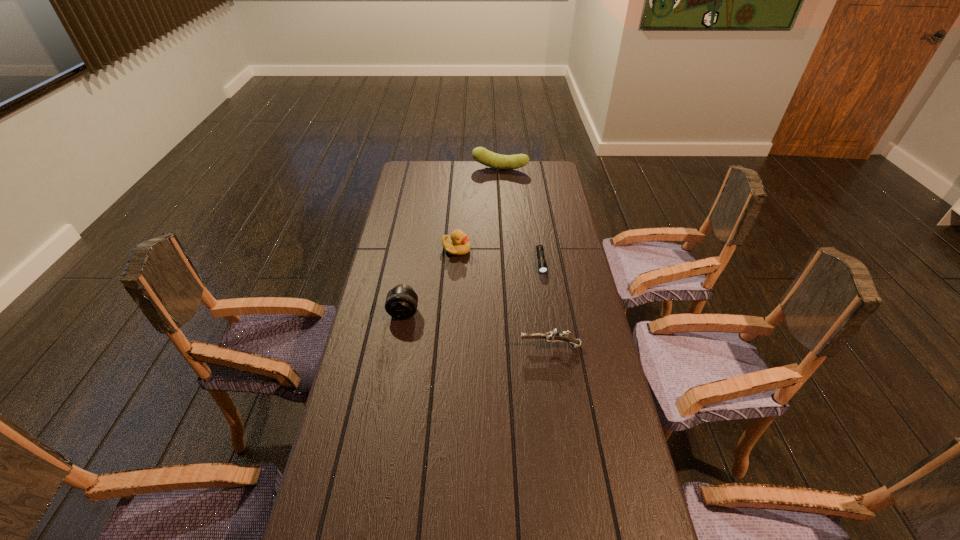
Find the location of a particular element. This screenshot has width=960, height=540. free point located 0.120m aimed along the barrel of the second shortest object is located at coordinates (482, 347).

You are a GUI agent. You are given a task and a screenshot of the screen. Output one action in this format:
    pyautogui.click(x=<x>, y=<y>)
    Task: Click on the vacant area situated aimed along the barrel of the second shortest object
    The height and width of the screenshot is (540, 960).
    Given the screenshot: What is the action you would take?
    pyautogui.click(x=471, y=347)

Identify the location of vacant space situated aimed along the barrel of the second shortest object. Image resolution: width=960 pixels, height=540 pixels. (401, 347).

Where is `free space located 0.130m at the lens end of the flashlight`? Image resolution: width=960 pixels, height=540 pixels. free space located 0.130m at the lens end of the flashlight is located at coordinates (547, 299).

This screenshot has width=960, height=540. I want to click on object that is at the far edge, so click(x=488, y=158).

Locate an element on the screen. object that is at the left edge is located at coordinates (401, 302).

At what (x,y) coordinates should I click in order to perform the action: click on cucumber that is at the right edge. Please return your answer as a coordinate pair (x, y). Looking at the image, I should click on (488, 158).

Find the location of a particular element. The image size is (960, 540). gun that is positioned at the right edge is located at coordinates (553, 337).

This screenshot has width=960, height=540. I want to click on flashlight situated at the right edge, so click(542, 265).

Locate an element on the screen. This screenshot has width=960, height=540. object present at the far right corner is located at coordinates (488, 158).